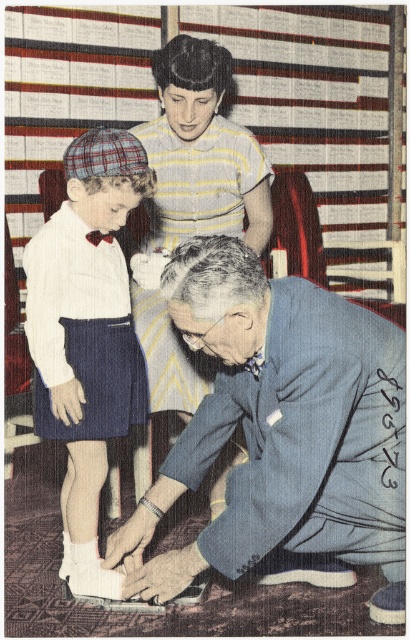
You are a tailor observing the vintage photograph. You need to determine which object is bigger between the blue fabric suit at lower center and the matte plaid cap at left. Which one is larger?

The blue fabric suit at lower center is larger than the matte plaid cap at left according to the description.

Consider the image. You are a tailor observing the blue fabric suit at lower center and the striped fabric dress at upper center in the vintage photograph. Which garment appears shorter in the image?

The blue fabric suit at lower center has a lesser height compared to the striped fabric dress at upper center, so the blue fabric suit at lower center appears shorter in the image.

You are a tailor observing the vintage photograph and need to determine if the blue fabric suit at lower center can be altered to fit the matte plaid cap at left. Based on their widths, can the cap be accommodated within the suit material?

The blue fabric suit at lower center might be wider than matte plaid cap at left, so there is a possibility that the cap can be accommodated within the suit material. However, since the width comparison is uncertain, further measurement would be needed to confirm.